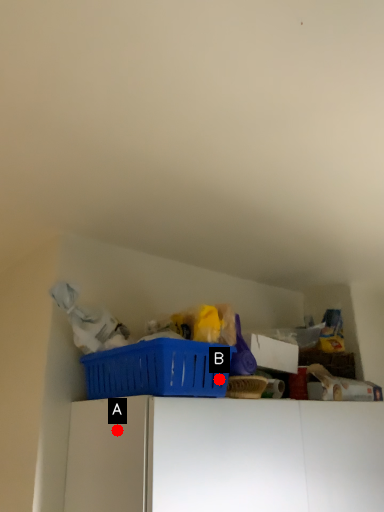
Question: Two points are circled on the image, labeled by A and B beside each circle. Which point appears closest to the camera in this image?

Choices:
 (A) A is closer
 (B) B is closer

Answer: (A)